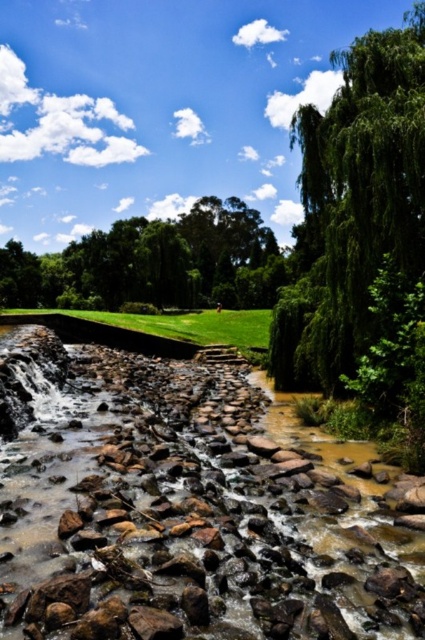
Question: Which point is closer to the camera?

Choices:
 (A) (234, 524)
 (B) (329, 168)
 (C) (90, 316)
 (D) (42, 259)

Answer: (A)

Question: Which point is farther to the camera?

Choices:
 (A) (170, 333)
 (B) (48, 340)
 (C) (175, 228)
 (D) (399, 56)

Answer: (C)

Question: Is the position of green leafy tree at center more distant than that of green grass at center?

Choices:
 (A) yes
 (B) no

Answer: (A)

Question: Which point is closer to the camera taking this photo?

Choices:
 (A) (149, 244)
 (B) (411, 81)
 (C) (34, 384)

Answer: (C)

Question: Is green leafy tree at upper right bigger than green grass at center?

Choices:
 (A) yes
 (B) no

Answer: (A)

Question: Does green leafy tree at upper right have a lesser width compared to green grass at center?

Choices:
 (A) yes
 (B) no

Answer: (A)